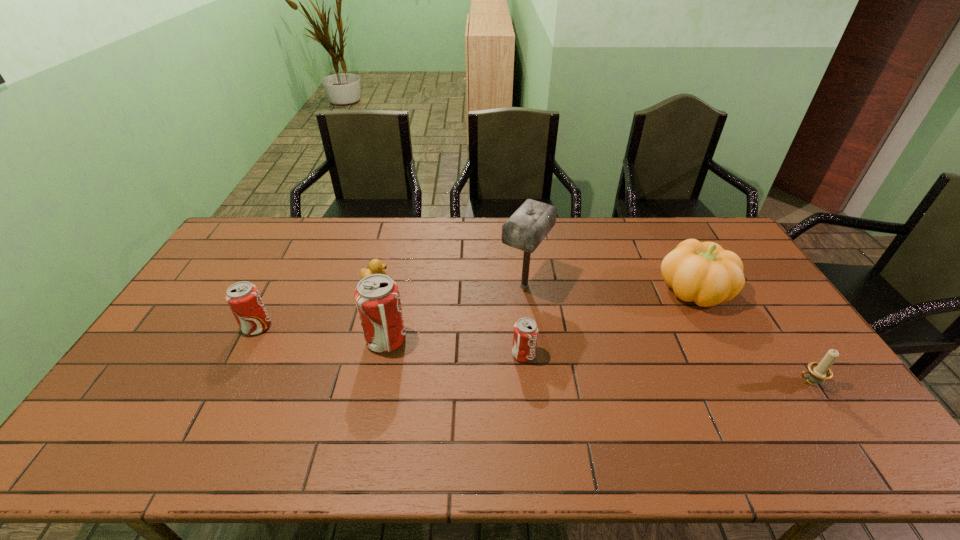
This screenshot has height=540, width=960. Identify the location of vacant region between the duckling and the second tallest soda can. (316, 303).

Locate an element on the screen. This screenshot has width=960, height=540. vacant space in between the leftmost object and the sixth object from left to right is located at coordinates (475, 309).

Locate an element on the screen. free area in between the sixth shortest object and the tallest object is located at coordinates (455, 313).

You are a GUI agent. You are given a task and a screenshot of the screen. Output one action in this format:
    pyautogui.click(x=<x>, y=<y>)
    Task: Click on the vacant area between the rightmost object and the pumpkin
    
    Given the screenshot: What is the action you would take?
    pyautogui.click(x=752, y=336)

You are a GUI agent. You are given a task and a screenshot of the screen. Output one action in this format:
    pyautogui.click(x=<x>, y=<y>)
    Task: Click on the vacant area that lies between the second soda can from left to right and the leftmost soda can
    
    Given the screenshot: What is the action you would take?
    pyautogui.click(x=322, y=334)

This screenshot has width=960, height=540. In order to click on vacant space that is in between the second object from right to left and the leftmost object in this screenshot , I will do `click(475, 309)`.

The image size is (960, 540). I want to click on object that is the fourth closest to the pumpkin, so click(377, 297).

Choose which object is the sixth nearest neighbor to the mallet. Please provide its 2D coordinates. Your answer should be formatted as a tuple, i.e. [(x, y)], where the tuple contains the x and y coordinates of a point satisfying the conditions above.

[(243, 298)]

Point out which soda can is positioned as the nearest to the mallet. Please provide its 2D coordinates. Your answer should be formatted as a tuple, i.e. [(x, y)], where the tuple contains the x and y coordinates of a point satisfying the conditions above.

[(525, 336)]

Select which soda can appears as the closest to the duckling. Please provide its 2D coordinates. Your answer should be formatted as a tuple, i.e. [(x, y)], where the tuple contains the x and y coordinates of a point satisfying the conditions above.

[(377, 297)]